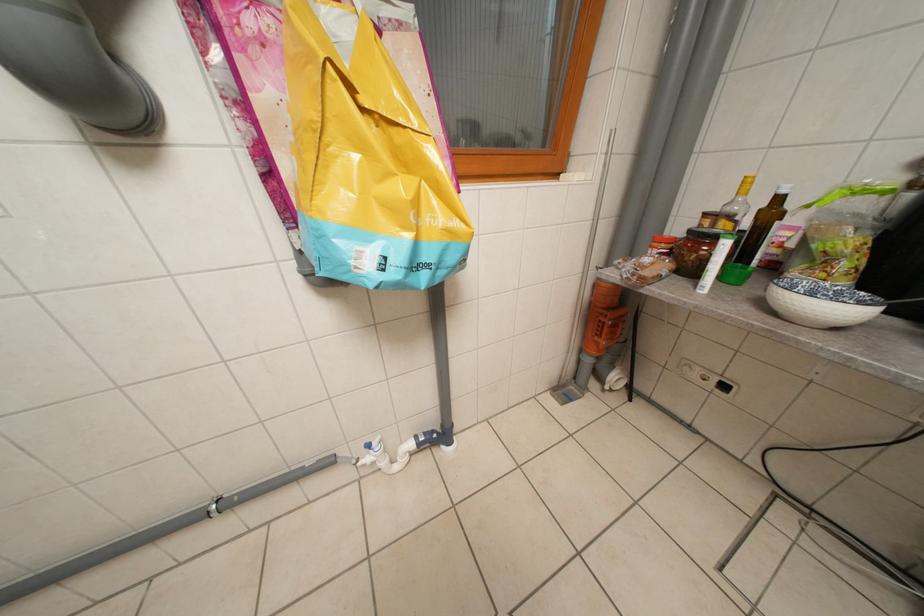
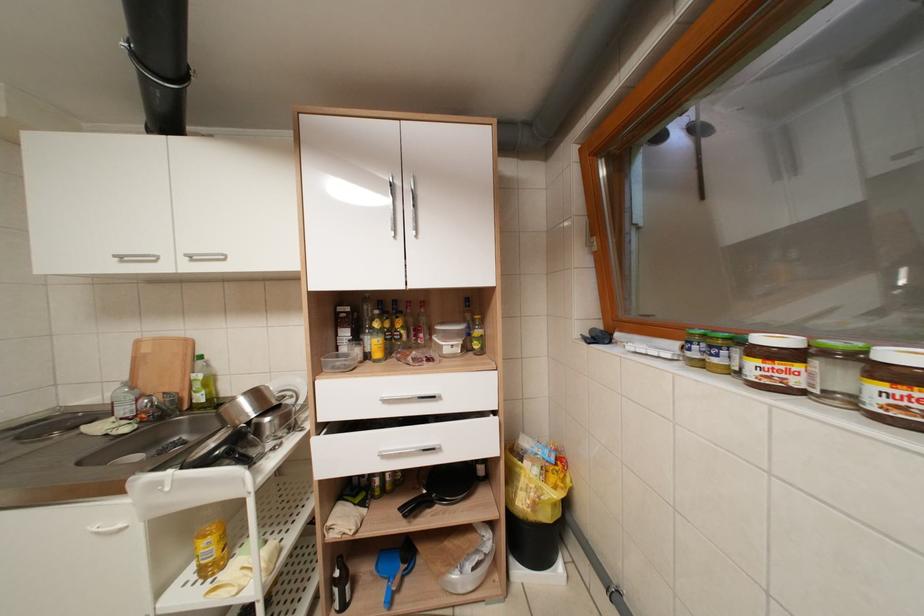
Question: The camera is either moving clockwise (left) or counter-clockwise (right) around the object. The first image is from the beginning of the video and the second image is from the end. Is the camera moving left or right when shooting the video?

Choices:
 (A) Left
 (B) Right

Answer: (B)